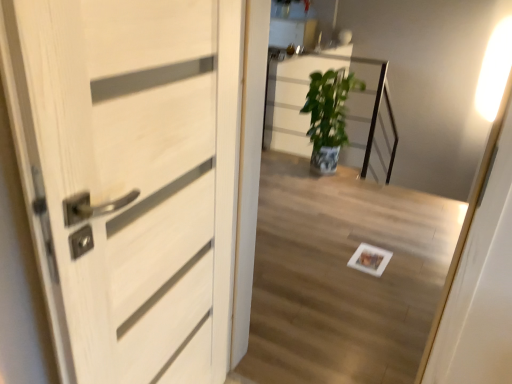
Question: From a real-world perspective, does green glossy plant at center sit lower than white wood door at left?

Choices:
 (A) no
 (B) yes

Answer: (B)

Question: From the image's perspective, is green glossy plant at center beneath white wood door at left?

Choices:
 (A) yes
 (B) no

Answer: (B)

Question: Is green glossy plant at center beside white wood door at left?

Choices:
 (A) no
 (B) yes

Answer: (A)

Question: Could you tell me if green glossy plant at center is turned towards white wood door at left?

Choices:
 (A) yes
 (B) no

Answer: (A)

Question: Is green glossy plant at center surrounding white wood door at left?

Choices:
 (A) yes
 (B) no

Answer: (B)

Question: Can you confirm if green glossy plant at center is wider than white wood door at left?

Choices:
 (A) no
 (B) yes

Answer: (B)

Question: From a real-world perspective, is white wood door at left positioned over white glossy light at upper right based on gravity?

Choices:
 (A) no
 (B) yes

Answer: (A)

Question: Can you confirm if white wood door at left is positioned to the right of white glossy light at upper right?

Choices:
 (A) no
 (B) yes

Answer: (A)

Question: From the image's perspective, is white wood door at left beneath white glossy light at upper right?

Choices:
 (A) yes
 (B) no

Answer: (A)

Question: From a real-world perspective, is white wood door at left positioned under white glossy light at upper right based on gravity?

Choices:
 (A) no
 (B) yes

Answer: (B)

Question: Does white wood door at left have a greater height compared to white glossy light at upper right?

Choices:
 (A) no
 (B) yes

Answer: (B)

Question: From the image's perspective, is white wood door at left above white glossy light at upper right?

Choices:
 (A) no
 (B) yes

Answer: (A)

Question: Can you confirm if white glossy light at upper right is bigger than white wood door at left?

Choices:
 (A) no
 (B) yes

Answer: (A)